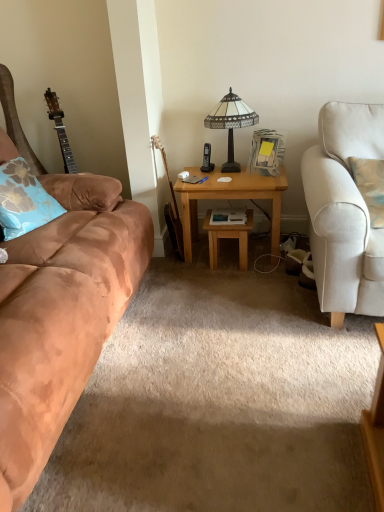
This screenshot has height=512, width=384. What are the coordinates of `free space that is in between wooden table at center and wooden acoustic guitar at center` in the screenshot? It's located at (198, 258).